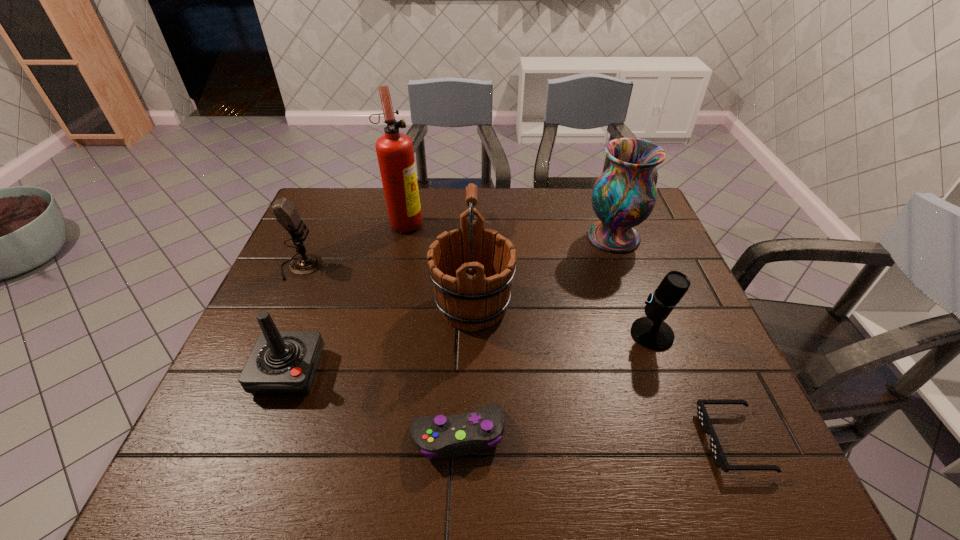
You are a GUI agent. You are given a task and a screenshot of the screen. Output one action in this format:
    pyautogui.click(x=<x>, y=<y>)
    Task: Click on the free region at the near edge
    Image resolution: width=960 pixels, height=540 pixels.
    Given the screenshot: What is the action you would take?
    pyautogui.click(x=584, y=467)

Identify the location of blank space at the left edge of the desktop. The height and width of the screenshot is (540, 960). click(x=241, y=411).

Image resolution: width=960 pixels, height=540 pixels. Find the location of `free space at the right edge of the desktop`. free space at the right edge of the desktop is located at coordinates (657, 258).

Find the location of a particular element. This screenshot has width=960, height=540. vacant space at the far left corner is located at coordinates (344, 197).

Locate an element on the screen. vacant point located between the sixth object from right to left and the second shortest object is located at coordinates (431, 328).

The width and height of the screenshot is (960, 540). Identify the location of vacant space that is in between the seventh shortest object and the vase. (543, 271).

I want to click on unoccupied area between the farther microphone and the wine bucket, so click(387, 286).

Identify the location of empty space that is in between the joystick and the sunglasses. (511, 406).

The image size is (960, 540). I want to click on free space between the sunglasses and the joystick, so click(x=511, y=406).

I want to click on vacant space in between the second shortest object and the joystick, so click(x=373, y=403).